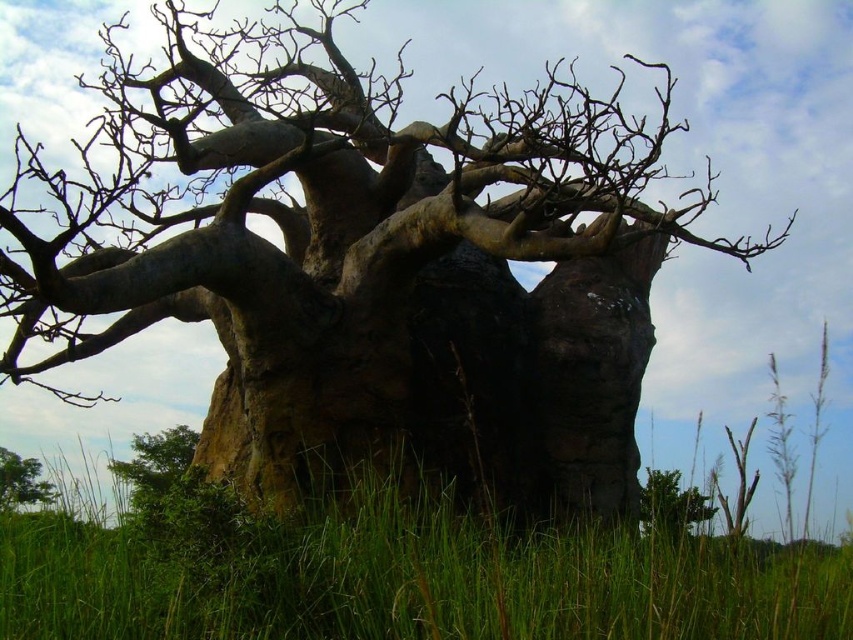
You are standing in the field and want to walk to the base of the tree. Which direction should you move relative to the green leafy bush at lower left and the green rough tree at lower left?

You should move to the left side of the green leafy bush at lower left since it is on the right side of the green rough tree at lower left, meaning the tree is to the left of the bush.